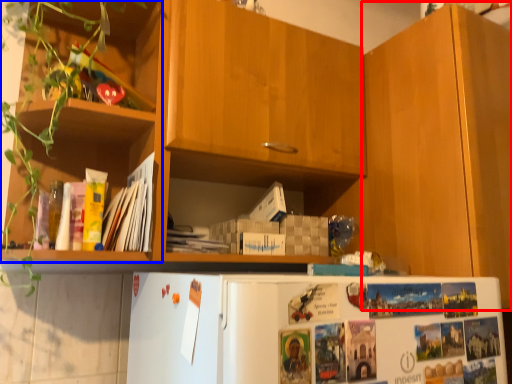
Question: Among these objects, which one is farthest to the camera, cabinetry (highlighted by a red box) or shelf (highlighted by a blue box)?

Choices:
 (A) cabinetry
 (B) shelf

Answer: (A)